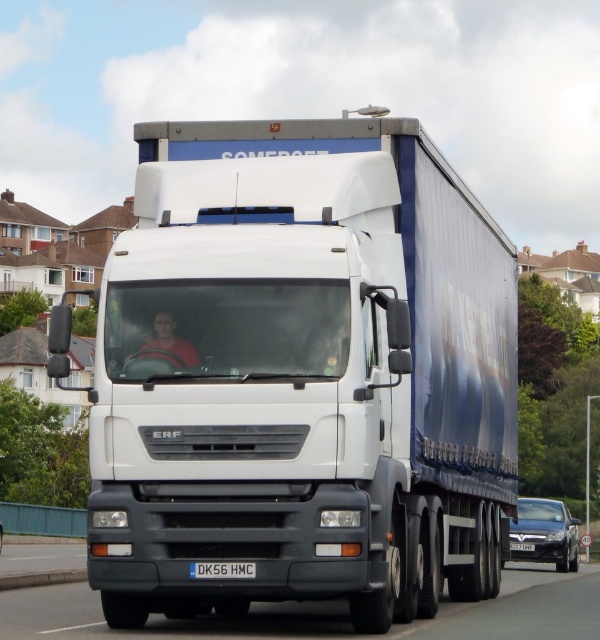
Question: Which object appears closest to the camera in this image?

Choices:
 (A) black rubber highway at center
 (B) white matte truck at center
 (C) white plastic license plate at center

Answer: (B)

Question: Considering the relative positions of white matte truck at center and black rubber highway at center in the image provided, where is white matte truck at center located with respect to black rubber highway at center?

Choices:
 (A) right
 (B) left

Answer: (B)

Question: Does white matte truck at center appear on the right side of black plastic license plate at center?

Choices:
 (A) no
 (B) yes

Answer: (B)

Question: Which of the following is the closest to the observer?

Choices:
 (A) white plastic license plate at center
 (B) black plastic license plate at center
 (C) black rubber highway at center
 (D) white matte truck at center

Answer: (D)

Question: Which object is positioned closest to the black plastic license plate at center?

Choices:
 (A) black rubber highway at center
 (B) white plastic license plate at center
 (C) white matte truck at center

Answer: (C)

Question: Can you confirm if white matte truck at center is positioned above white plastic license plate at center?

Choices:
 (A) no
 (B) yes

Answer: (B)